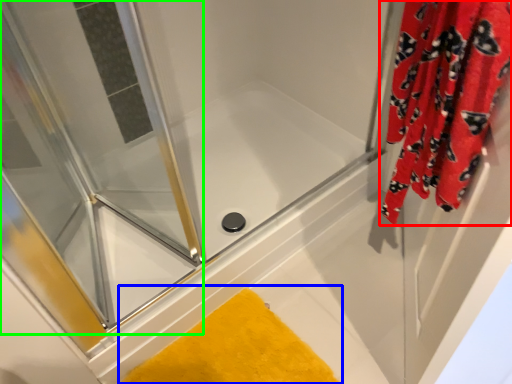
Question: Which object is the closest to the curtain (highlighted by a red box)? Choose among these: bath mat (highlighted by a blue box) or screen door (highlighted by a green box).

Choices:
 (A) bath mat
 (B) screen door

Answer: (A)